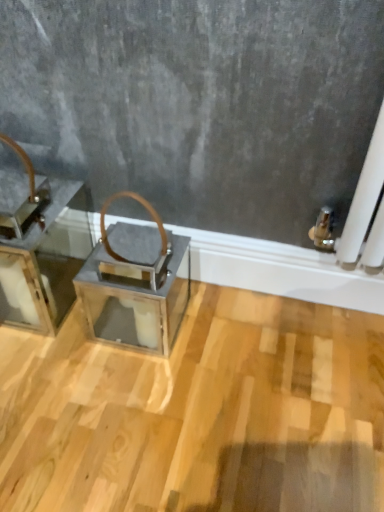
Where is `vacant area that is in front of metallic silver tray at left`? This screenshot has width=384, height=512. vacant area that is in front of metallic silver tray at left is located at coordinates (41, 369).